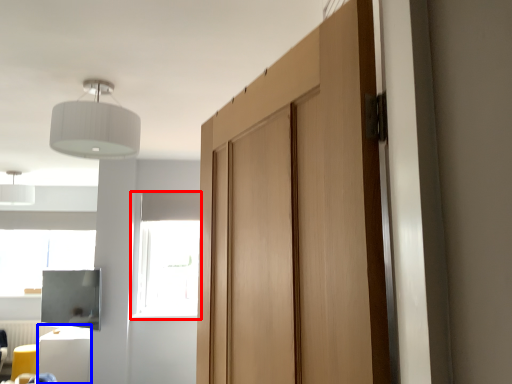
Question: Which point is further to the camera, window (highlighted by a red box) or furniture (highlighted by a blue box)?

Choices:
 (A) window
 (B) furniture

Answer: (A)